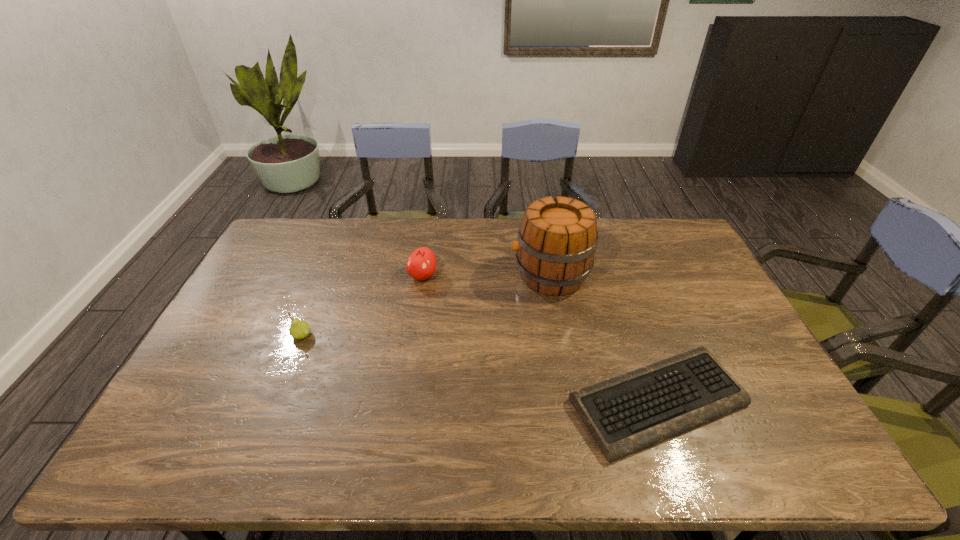
The height and width of the screenshot is (540, 960). Identify the location of free region located on the front of the second tallest object. [x=415, y=333].

Locate an element on the screen. This screenshot has width=960, height=540. vacant space located 0.060m on the back of the second nearest object is located at coordinates (310, 314).

Image resolution: width=960 pixels, height=540 pixels. In order to click on vacant space located on the back of the nearest object in this screenshot , I will do `click(636, 339)`.

The height and width of the screenshot is (540, 960). What are the coordinates of `object at the far edge` in the screenshot? It's located at (557, 238).

Identify the location of object present at the near edge. The image size is (960, 540). (625, 414).

Image resolution: width=960 pixels, height=540 pixels. I want to click on object situated at the right edge, so click(625, 414).

Where is `object present at the near right corner`? object present at the near right corner is located at coordinates (625, 414).

This screenshot has height=540, width=960. I want to click on vacant space at the near edge of the desktop, so click(x=334, y=460).

You are a GUI agent. You are given a task and a screenshot of the screen. Output one action in this format:
    pyautogui.click(x=<x>, y=<y>)
    Task: Click on the vacant space at the left edge
    The width and height of the screenshot is (960, 540).
    Given the screenshot: What is the action you would take?
    tap(217, 389)

I want to click on free space at the far left corner, so click(291, 252).